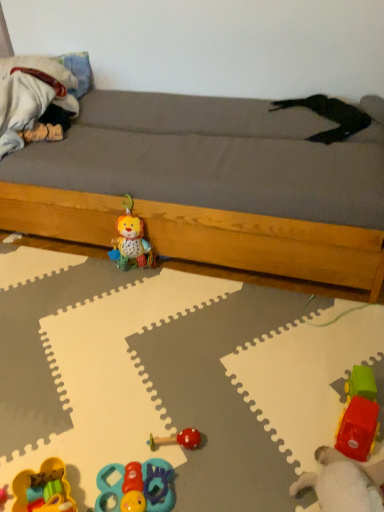
Locate an element on the screen. The height and width of the screenshot is (512, 384). free space on the front side of plush fabric lion at center, the 2th toy when ordered from left to right is located at coordinates (132, 295).